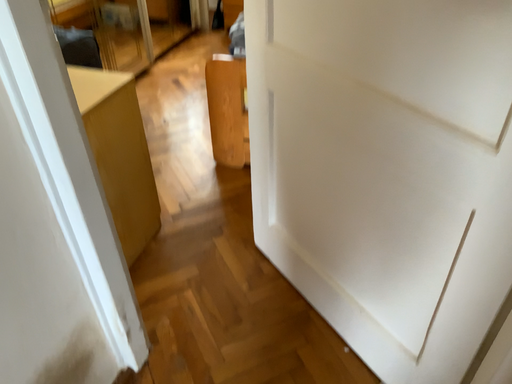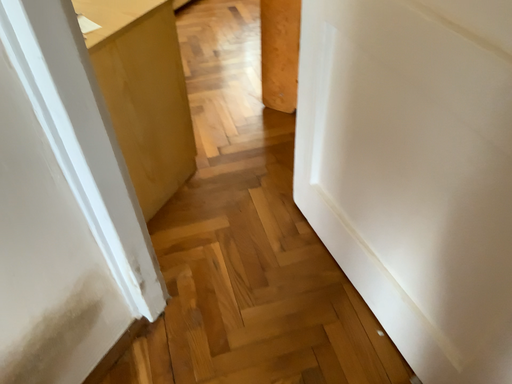
Question: How did the camera likely rotate when shooting the video?

Choices:
 (A) rotated upward
 (B) rotated downward

Answer: (B)